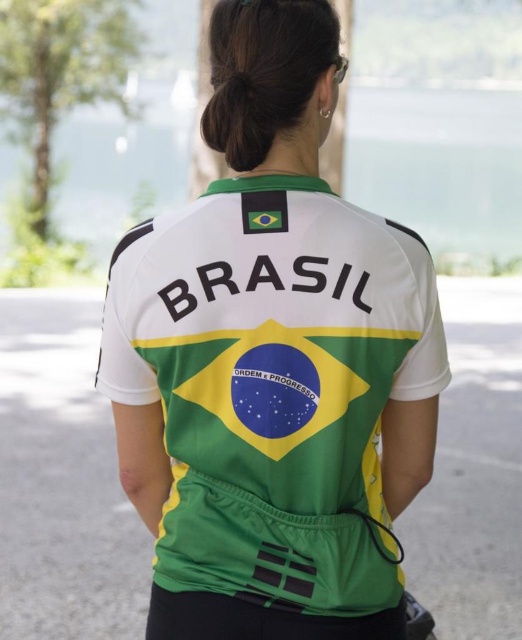
Question: Is white jersey at center positioned before black hair at upper center?

Choices:
 (A) no
 (B) yes

Answer: (B)

Question: Which of the following is the farthest from the observer?

Choices:
 (A) (312, 12)
 (B) (116, 392)

Answer: (A)

Question: Considering the relative positions of white jersey at center and black hair at upper center in the image provided, where is white jersey at center located with respect to black hair at upper center?

Choices:
 (A) below
 (B) above

Answer: (A)

Question: Which point is closer to the camera?

Choices:
 (A) white jersey at center
 (B) black hair at upper center

Answer: (A)

Question: Which of the following is the farthest from the observer?

Choices:
 (A) black hair at upper center
 (B) white jersey at center

Answer: (A)

Question: Considering the relative positions of white jersey at center and black hair at upper center in the image provided, where is white jersey at center located with respect to black hair at upper center?

Choices:
 (A) right
 (B) left

Answer: (A)